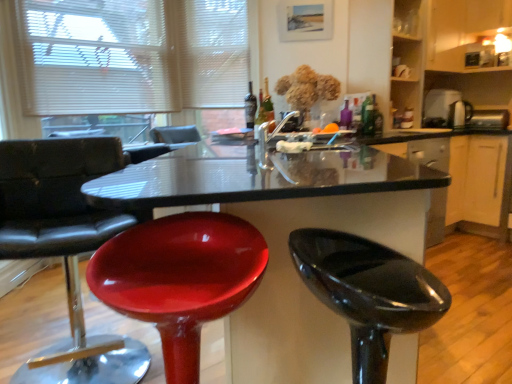
Question: Could you tell me if glossy plastic table at center is turned towards glossy plastic stool at left, arranged as the third chair when viewed from the right?

Choices:
 (A) no
 (B) yes

Answer: (A)

Question: Is glossy plastic stool at left, arranged as the third chair when viewed from the right, located within glossy plastic table at center?

Choices:
 (A) no
 (B) yes

Answer: (A)

Question: Is glossy plastic table at center at the left side of glossy plastic stool at left, the first chair in the left-to-right sequence?

Choices:
 (A) yes
 (B) no

Answer: (B)

Question: Considering the relative sizes of glossy plastic table at center and glossy plastic stool at left, the first chair in the left-to-right sequence, in the image provided, is glossy plastic table at center taller than glossy plastic stool at left, the first chair in the left-to-right sequence,?

Choices:
 (A) yes
 (B) no

Answer: (B)

Question: Is glossy plastic table at center further to the viewer compared to glossy plastic stool at left, arranged as the third chair when viewed from the right?

Choices:
 (A) yes
 (B) no

Answer: (B)

Question: Is glossy plastic table at center smaller than glossy plastic stool at left, the first chair in the left-to-right sequence?

Choices:
 (A) no
 (B) yes

Answer: (A)

Question: Does metallic silver toaster at right, acting as the third appliance starting from the left, have a lesser height compared to white matte blinds at upper left?

Choices:
 (A) yes
 (B) no

Answer: (A)

Question: Is white matte blinds at upper left inside metallic silver toaster at right, which is counted as the 1th appliance, starting from the right?

Choices:
 (A) no
 (B) yes

Answer: (A)

Question: Is metallic silver toaster at right, acting as the third appliance starting from the left, positioned beyond the bounds of white matte blinds at upper left?

Choices:
 (A) yes
 (B) no

Answer: (A)

Question: From the image's perspective, is metallic silver toaster at right, which is counted as the 1th appliance, starting from the right, above white matte blinds at upper left?

Choices:
 (A) yes
 (B) no

Answer: (B)

Question: Does metallic silver toaster at right, which is counted as the 1th appliance, starting from the right, have a greater width compared to white matte blinds at upper left?

Choices:
 (A) no
 (B) yes

Answer: (B)

Question: Does metallic silver toaster at right, which is counted as the 1th appliance, starting from the right, have a greater height compared to white matte blinds at upper left?

Choices:
 (A) yes
 (B) no

Answer: (B)

Question: From the image's perspective, would you say metallic silver toaster at upper right, marked as the first appliance in a left-to-right arrangement, is shown under green glass bottle at upper center, marked as the 1th bottle in a front-to-back arrangement?

Choices:
 (A) yes
 (B) no

Answer: (B)